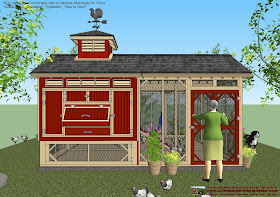
Find the location of `windows`. windows is located at coordinates (97, 45), (174, 106), (149, 106), (77, 153), (110, 152).